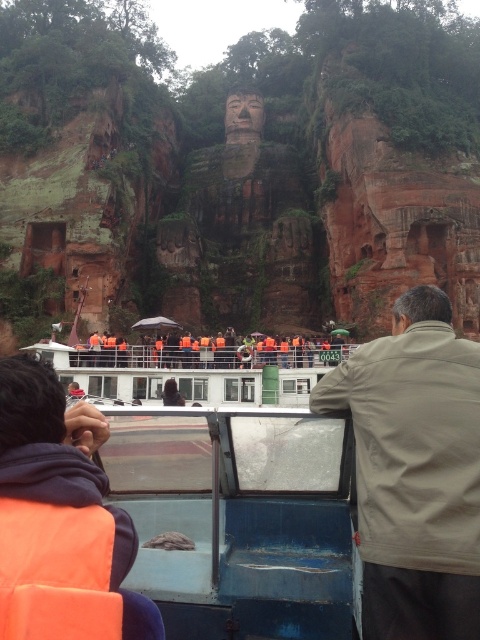
You are a tour guide on the boat and need to point out the beige fabric jacket at upper right and dark brown leather jacket at center to your passengers. Which jacket is closer to you as you stand facing the Buddha statue?

The beige fabric jacket at upper right is in front of the dark brown leather jacket at center, so the beige fabric jacket at upper right is closer to you.